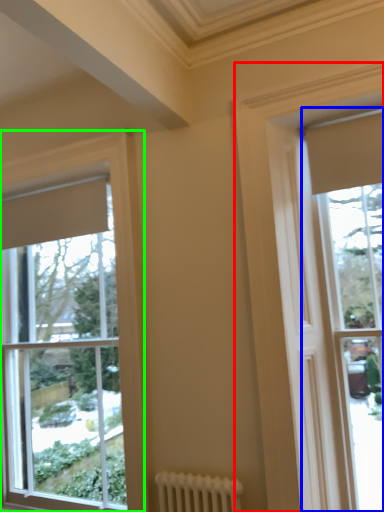
Question: Based on their relative distances, which object is nearer to window (highlighted by a red box)? Choose from window (highlighted by a blue box) and window (highlighted by a green box).

Choices:
 (A) window
 (B) window

Answer: (A)